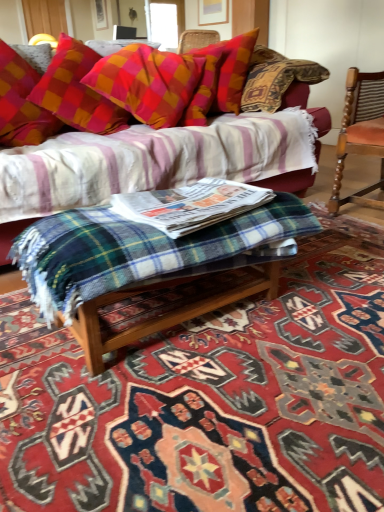
The width and height of the screenshot is (384, 512). I want to click on free space below green plaid blanket at center (from a real-world perspective), so click(x=207, y=329).